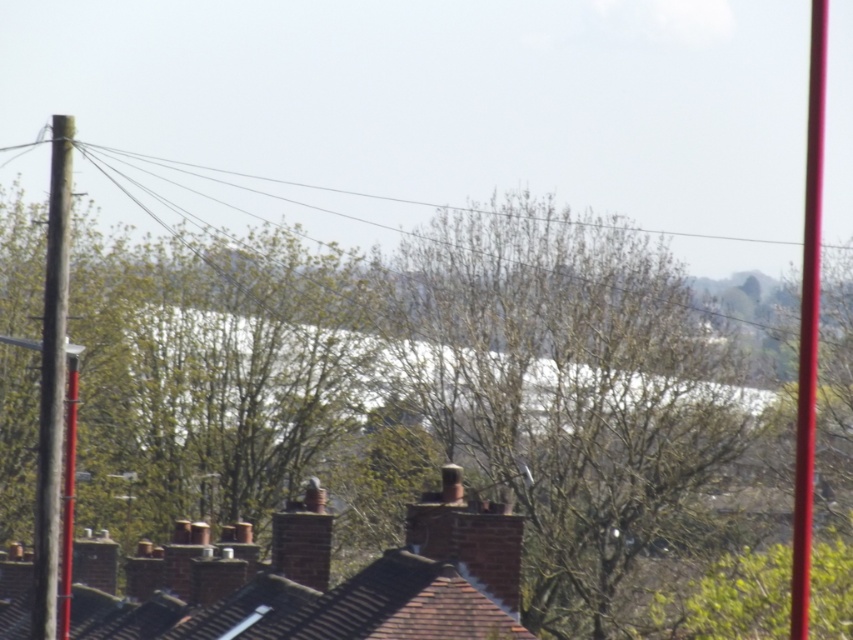
You are an urban planner analyzing the rooftop area. You notice the green leafy tree at center and the smooth glossy pole at right. Which object takes up more visual space in the scene?

The smooth glossy pole at right takes up more visual space than the green leafy tree at center according to the description.

You are standing at the highest point of the rooftop and looking out. There is a point marked at coordinates (408, 435). What object does this point correspond to?

The point at coordinates (408, 435) corresponds to the green leafy tree at center.

You are an architect designing a new fence for this area. You have two poles to choose from in the scene. The smooth wooden pole at left and the smooth glossy pole at right. Which pole is narrower in width?

The smooth wooden pole at left is narrower in width than the smooth glossy pole at right.